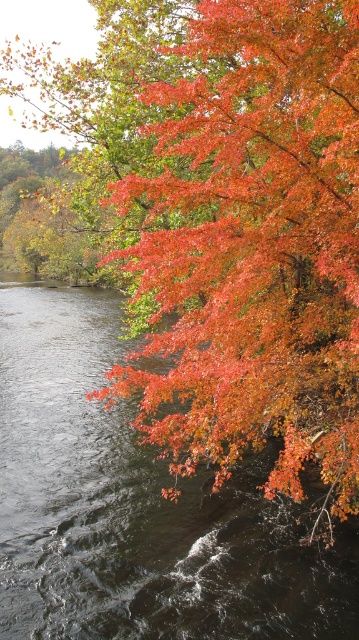
Question: Which point is closer to the camera?

Choices:
 (A) dark water at lower left
 (B) shiny orange leaves at upper right

Answer: (B)

Question: Which point appears farthest from the camera in this image?

Choices:
 (A) (310, 576)
 (B) (182, 298)

Answer: (B)

Question: Is shiny orange leaves at upper right to the left of dark water at lower left from the viewer's perspective?

Choices:
 (A) yes
 (B) no

Answer: (B)

Question: Is shiny orange leaves at upper right further to the viewer compared to dark water at lower left?

Choices:
 (A) yes
 (B) no

Answer: (B)

Question: Where is shiny orange leaves at upper right located in relation to dark water at lower left in the image?

Choices:
 (A) right
 (B) left

Answer: (A)

Question: Among these objects, which one is farthest from the camera?

Choices:
 (A) shiny orange leaves at upper right
 (B) dark water at lower left

Answer: (B)